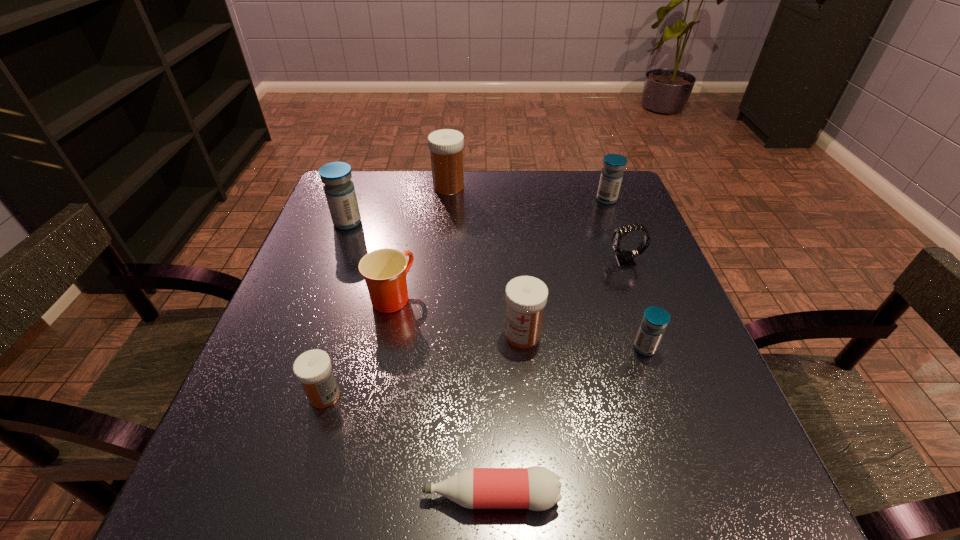
Locate an element on the screen. This screenshot has height=540, width=960. blank area located on the right of the cup is located at coordinates (438, 296).

Locate an element on the screen. The image size is (960, 540). free location located on the face of the watch is located at coordinates (534, 260).

The width and height of the screenshot is (960, 540). In order to click on vacant space located 0.250m on the face of the watch in this screenshot , I will do `click(499, 260)`.

What are the coordinates of `vacant space situated on the face of the watch` in the screenshot? It's located at (561, 260).

You are a GUI agent. You are given a task and a screenshot of the screen. Output one action in this format:
    pyautogui.click(x=<x>, y=<y>)
    Task: Click on the vacant area located 0.360m on the left of the nearest blue medicine
    The width and height of the screenshot is (960, 540).
    Given the screenshot: What is the action you would take?
    pyautogui.click(x=441, y=348)

Locate an element on the screen. vacant space located on the front of the nearest white medicine is located at coordinates (304, 463).

At what (x,y) coordinates should I click in order to perform the action: click on free location located with the cap open on the shortest object. Please return your answer as a coordinate pair (x, y). Looking at the image, I should click on (382, 496).

The height and width of the screenshot is (540, 960). What are the coordinates of `vacant position located 0.220m with the cap open on the shortest object` in the screenshot? It's located at (270, 496).

The image size is (960, 540). What are the coordinates of `vacant space positioned 0.080m with the cap open on the shortest object` in the screenshot? It's located at (368, 496).

I want to click on object present at the near edge, so click(x=537, y=488).